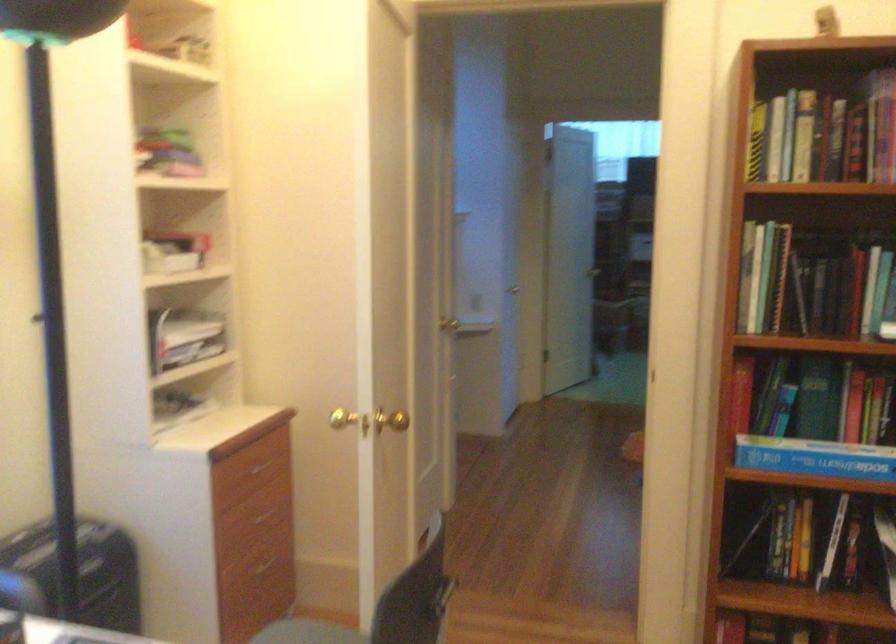
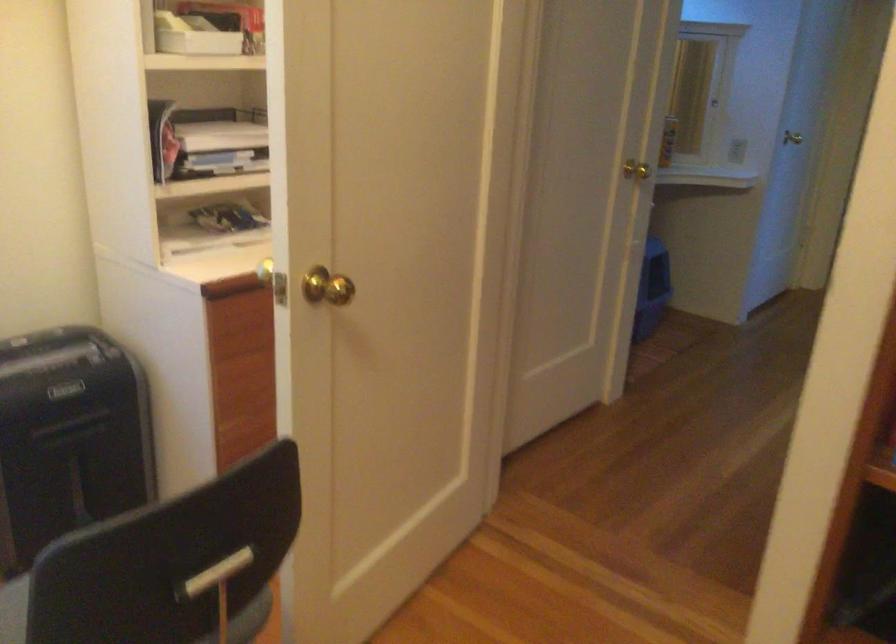
Question: How did the camera likely rotate?

Choices:
 (A) Left
 (B) Right
 (C) Up
 (D) Down

Answer: (A)